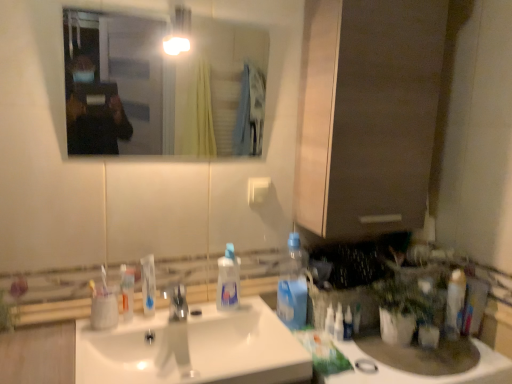
Find the location of `free space above white glossy counter top at lower right (from a real-world perspective)`. free space above white glossy counter top at lower right (from a real-world perspective) is located at coordinates (396, 356).